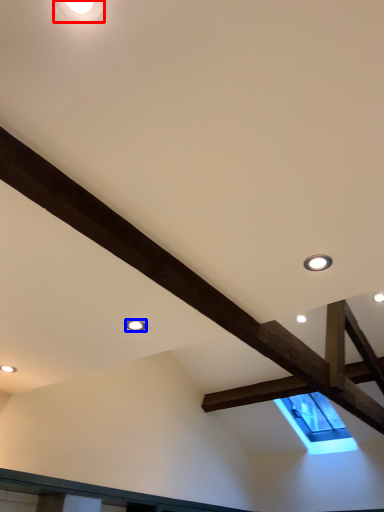
Question: Which point is closer to the camera, droplight (highlighted by a red box) or droplight (highlighted by a blue box)?

Choices:
 (A) droplight
 (B) droplight

Answer: (A)